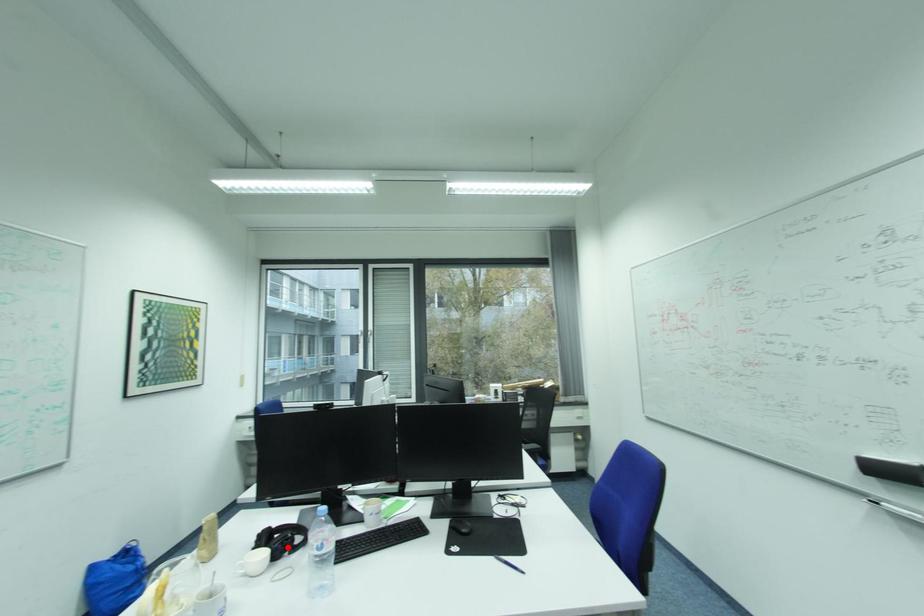
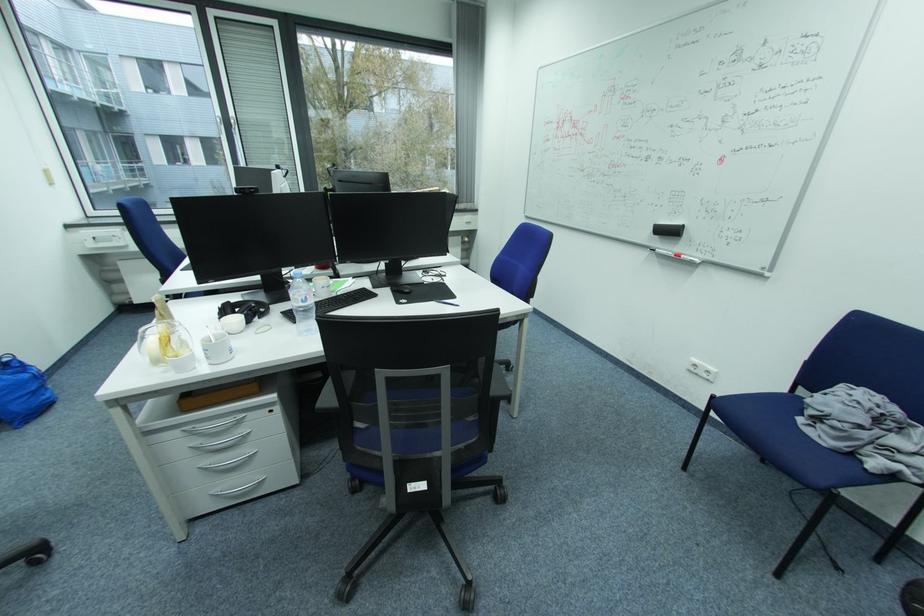
Find the pixel in the second image that matches the highlighted location in the first image.

(259, 313)